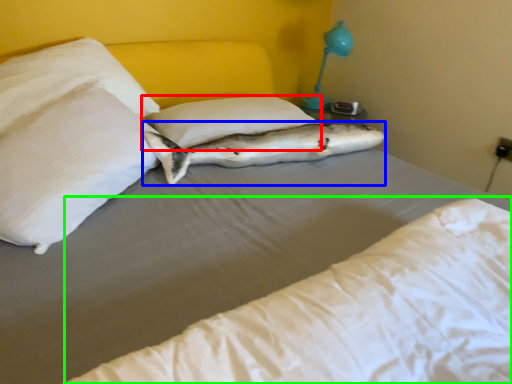
Question: Based on their relative distances, which object is nearer to pillow (highlighted by a red box)? Choose from fish (highlighted by a blue box) and mattress (highlighted by a green box).

Choices:
 (A) fish
 (B) mattress

Answer: (A)